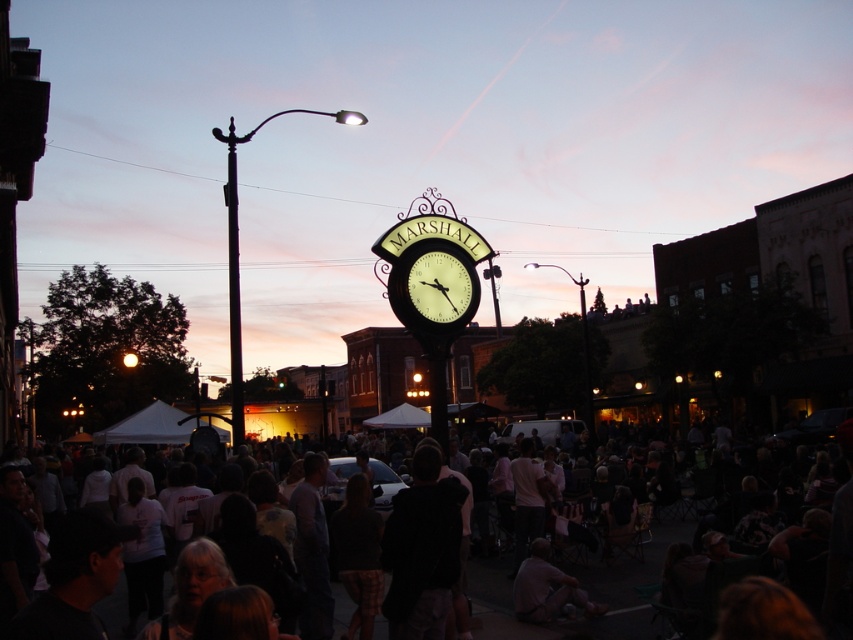
You are a photographer trying to capture the matte black clock at center without the dark clothing crowd at center blocking it. Given their sizes, is this feasible?

The dark clothing crowd at center has a larger size compared to the matte black clock at center, so it would likely block the view of the clock unless you move to a different angle or position where the crowd is not obstructing it.